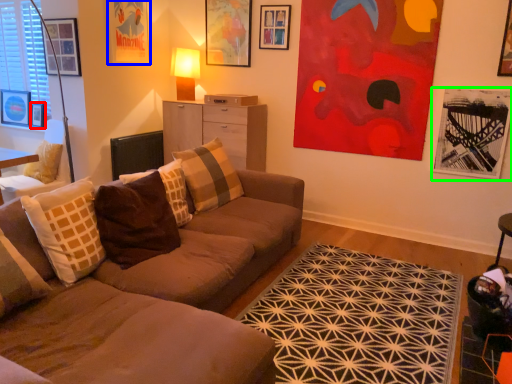
Question: Considering the real-world distances, which object is closest to picture frame (highlighted by a red box)? picture frame (highlighted by a blue box) or picture frame (highlighted by a green box).

Choices:
 (A) picture frame
 (B) picture frame

Answer: (A)